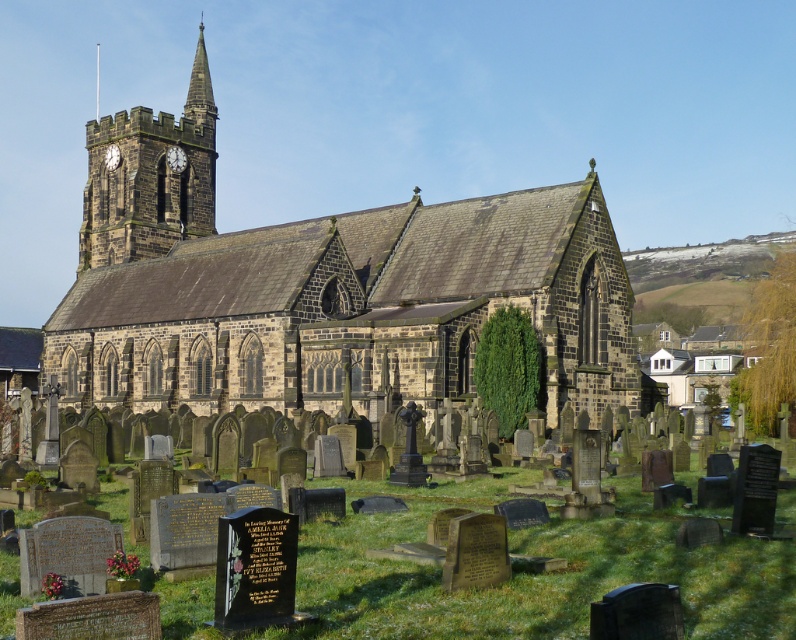
Is point (416, 336) farther from viewer compared to point (196, 90)?

No, (416, 336) is in front of (196, 90).

Is point (143, 236) positioned in front of point (194, 108)?

Yes, it is in front of point (194, 108).

Is point (314, 321) behind point (199, 88)?

No.

The image size is (796, 640). In order to click on brown stone church at center in this screenshot , I will do `click(326, 291)`.

Is brown stone church at center thinner than dark gray stone clock tower at upper left?

No, brown stone church at center is not thinner than dark gray stone clock tower at upper left.

Consider the image. Between brown stone church at center and dark gray stone clock tower at upper left, which one has less height?

brown stone church at center is shorter.

Locate an element on the screen. Image resolution: width=796 pixels, height=640 pixels. brown stone church at center is located at coordinates (326, 291).

Where is `brown stone church at center`? This screenshot has width=796, height=640. brown stone church at center is located at coordinates (326, 291).

Which is more to the left, dark gray stone clock tower at upper left or smooth stone spire at upper center?

Positioned to the left is dark gray stone clock tower at upper left.

Is dark gray stone clock tower at upper left positioned at the back of smooth stone spire at upper center?

No, it is not.

Which is in front, point (86, 252) or point (205, 52)?

Positioned in front is point (86, 252).

Image resolution: width=796 pixels, height=640 pixels. In order to click on dark gray stone clock tower at upper left in this screenshot , I will do `click(149, 177)`.